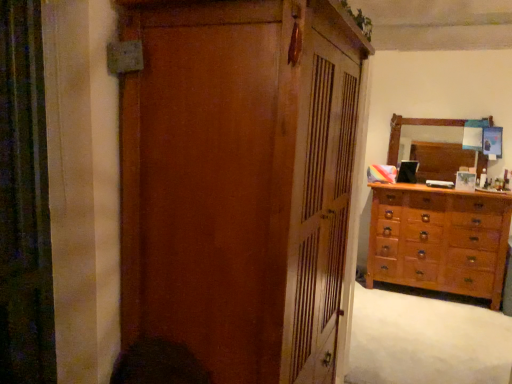
The image size is (512, 384). Find the location of `matte wood cupboard at center`. matte wood cupboard at center is located at coordinates (237, 183).

At what (x,y) coordinates should I click in order to perform the action: click on light brown wooden dresser at right. Please return your answer as a coordinate pair (x, y). Looking at the image, I should click on (439, 239).

Measure the distance between point (372, 224) and camera.

Point (372, 224) is 4.08 meters from camera.

Locate an element on the screen. The width and height of the screenshot is (512, 384). wooden dresser at lower right is located at coordinates (426, 341).

Is light brown wooden dresser at right oriented away from matte wood cupboard at center?

light brown wooden dresser at right does not have its back to matte wood cupboard at center.

Is light brown wooden dresser at right spatially inside matte wood cupboard at center, or outside of it?

light brown wooden dresser at right cannot be found inside matte wood cupboard at center.

Considering the sizes of objects light brown wooden dresser at right and matte wood cupboard at center in the image provided, who is smaller, light brown wooden dresser at right or matte wood cupboard at center?

light brown wooden dresser at right.

Does point (421, 320) come in front of point (181, 362)?

No, (421, 320) is further to viewer.

From the picture: Is wooden dresser at lower right inside the boundaries of matte wood cupboard at center, or outside?

wooden dresser at lower right cannot be found inside matte wood cupboard at center.

Considering the relative sizes of wooden dresser at lower right and matte wood cupboard at center in the image provided, is wooden dresser at lower right thinner than matte wood cupboard at center?

No.

In terms of width, does light brown wooden dresser at right look wider or thinner when compared to wooden dresser at lower right?

In the image, light brown wooden dresser at right appears to be more narrow than wooden dresser at lower right.

From the image's perspective, is light brown wooden dresser at right above or below wooden dresser at lower right?

Clearly, from the image's perspective, light brown wooden dresser at right is above wooden dresser at lower right.

Which of these two, light brown wooden dresser at right or wooden dresser at lower right, stands shorter?

Standing shorter between the two is wooden dresser at lower right.

Is light brown wooden dresser at right located within matte wood cupboard at center?

No, light brown wooden dresser at right is not inside matte wood cupboard at center.

Between matte wood cupboard at center and light brown wooden dresser at right, which one is positioned in front?

matte wood cupboard at center.

From the image's perspective, is matte wood cupboard at center positioned above or below light brown wooden dresser at right?

Clearly, from the image's perspective, matte wood cupboard at center is above light brown wooden dresser at right.

Which object is further away from the camera, light brown wooden dresser at right or wooden mirror at upper right?

wooden mirror at upper right.

Looking at this image, which point is more distant from viewer, (x=498, y=250) or (x=473, y=161)?

The point (x=473, y=161) is farther from the camera.

Locate an element on the screen. mirror on the right side of light brown wooden dresser at right is located at coordinates (440, 159).

Which is correct: light brown wooden dresser at right is inside wooden mirror at upper right, or outside of it?

light brown wooden dresser at right cannot be found inside wooden mirror at upper right.

Could you tell me if wooden dresser at lower right is facing wooden mirror at upper right?

No, wooden dresser at lower right does not turn towards wooden mirror at upper right.

Considering the positions of objects wooden dresser at lower right and wooden mirror at upper right in the image provided, who is more to the right, wooden dresser at lower right or wooden mirror at upper right?

Positioned to the right is wooden mirror at upper right.

Considering the points (362, 358) and (446, 168), which point is in front, point (362, 358) or point (446, 168)?

Positioned in front is point (362, 358).

Between wooden dresser at lower right and wooden mirror at upper right, which one has larger size?

Bigger between the two is wooden dresser at lower right.

Is matte wood cupboard at center facing towards wooden dresser at lower right?

No, matte wood cupboard at center is not facing towards wooden dresser at lower right.

From a real-world perspective, which is physically above, matte wood cupboard at center or wooden dresser at lower right?

From a 3D spatial view, matte wood cupboard at center is above.

In the scene shown: Between matte wood cupboard at center and wooden dresser at lower right, which one has less height?

With less height is wooden dresser at lower right.

Find the location of `chest of drawers located on the right of matte wood cupboard at center`. chest of drawers located on the right of matte wood cupboard at center is located at coordinates (439, 239).

Identify the location of cupboard above the wooden dresser at lower right (from a real-world perspective). (237, 183).

From the image, which object appears to be farther from light brown wooden dresser at right, wooden mirror at upper right or wooden dresser at lower right?

wooden mirror at upper right is further to light brown wooden dresser at right.

Consider the image. When comparing their distances from light brown wooden dresser at right, does wooden mirror at upper right or matte wood cupboard at center seem closer?

wooden mirror at upper right is closer to light brown wooden dresser at right.

Based on their spatial positions, is wooden dresser at lower right or wooden mirror at upper right closer to matte wood cupboard at center?

wooden dresser at lower right lies closer to matte wood cupboard at center than the other object.

Considering their positions, is light brown wooden dresser at right positioned closer to matte wood cupboard at center than wooden mirror at upper right?

light brown wooden dresser at right.

From the image, which object appears to be farther from matte wood cupboard at center, wooden mirror at upper right or light brown wooden dresser at right?

wooden mirror at upper right is positioned further to the anchor matte wood cupboard at center.

When comparing their distances from light brown wooden dresser at right, does wooden dresser at lower right or wooden mirror at upper right seem further?

wooden mirror at upper right lies further to light brown wooden dresser at right than the other object.

When comparing their distances from wooden mirror at upper right, does wooden dresser at lower right or light brown wooden dresser at right seem closer?

Based on the image, light brown wooden dresser at right appears to be nearer to wooden mirror at upper right.

Consider the image. From the image, which object appears to be farther from wooden mirror at upper right, wooden dresser at lower right or matte wood cupboard at center?

matte wood cupboard at center.

Locate an element on the screen. the chest of drawers positioned between matte wood cupboard at center and wooden mirror at upper right from near to far is located at coordinates (439, 239).

Identify the location of chest of drawers between wooden dresser at lower right and wooden mirror at upper right along the z-axis. This screenshot has width=512, height=384. (439, 239).

This screenshot has width=512, height=384. What are the coordinates of `plain between matte wood cupboard at center and wooden mirror at upper right along the z-axis` in the screenshot? It's located at (426, 341).

Locate an element on the screen. This screenshot has width=512, height=384. plain located between matte wood cupboard at center and light brown wooden dresser at right in the depth direction is located at coordinates pyautogui.click(x=426, y=341).